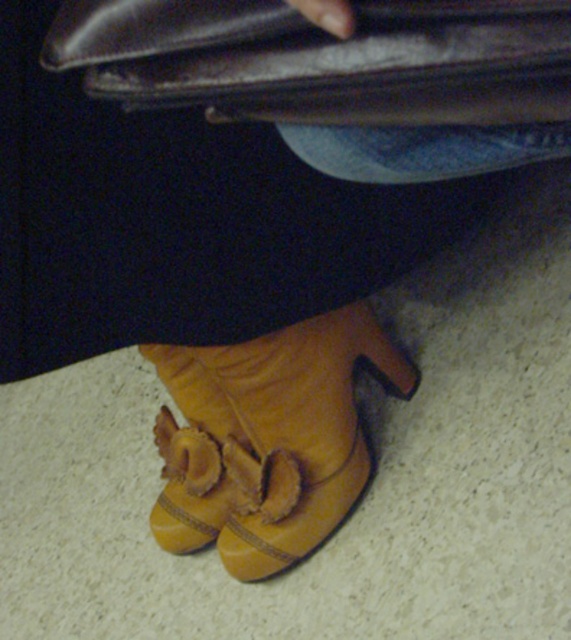
Is point (150, 67) positioned behind point (234, 568)?

That is False.

Is leather bag at upper center wider than suede boot at lower center?

Incorrect, leather bag at upper center's width does not surpass suede boot at lower center's.

Is point (345, 44) farther from viewer compared to point (271, 374)?

No, (345, 44) is closer to viewer.

Where is `leather bag at upper center`? Image resolution: width=571 pixels, height=640 pixels. leather bag at upper center is located at coordinates (321, 58).